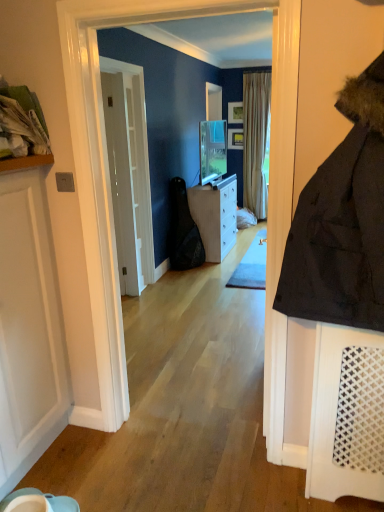
Locate an element on the screen. vacant area located to the right-hand side of white matte door at left, the 1th door viewed from the front is located at coordinates coord(113,468).